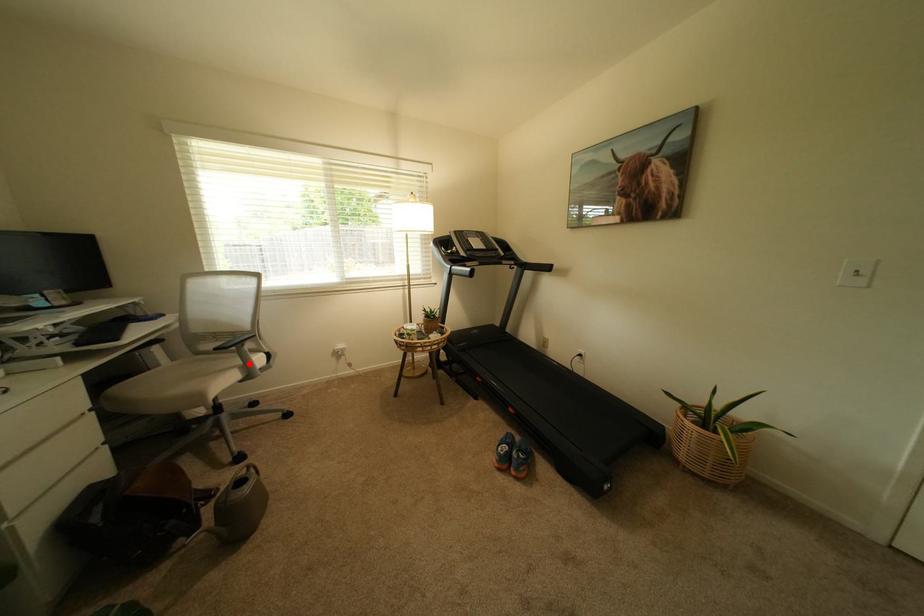
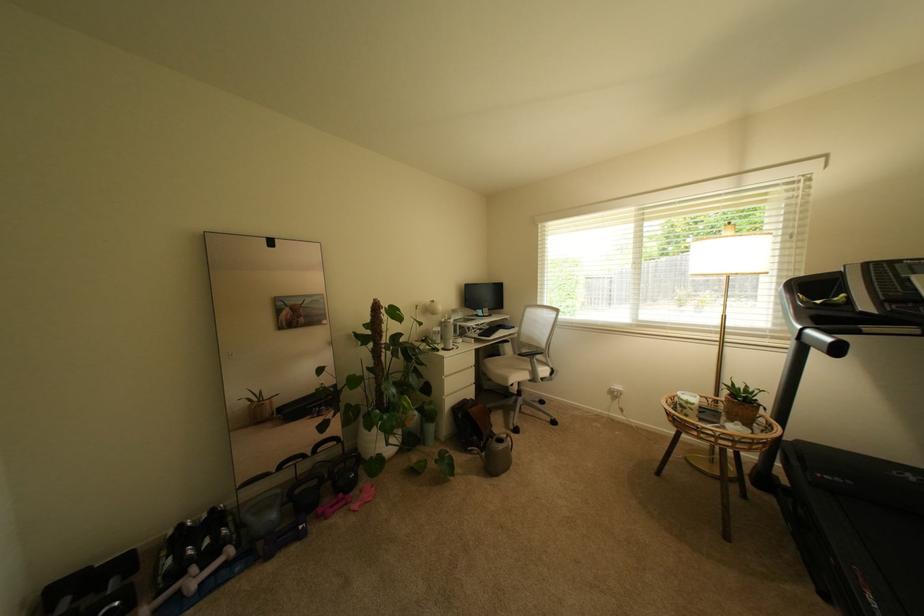
Question: I am providing you with two images of the same scene from different viewpoints. Image1 has a red point marked. In image2, the corresponding 3D location appears at what relative position? Reply with the corresponding letter.

Choices:
 (A) Closer
 (B) Farther

Answer: (B)